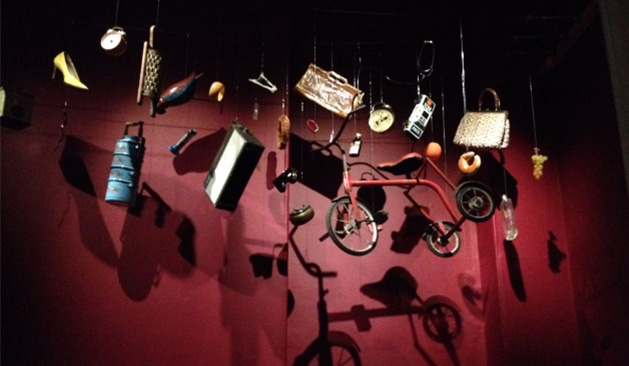
Image resolution: width=629 pixels, height=366 pixels. Identify the location of bottle. (509, 226).